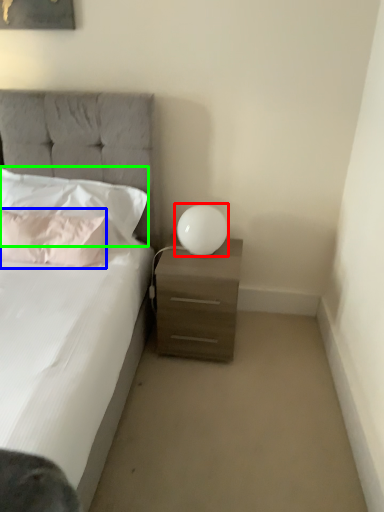
Question: Which object is the closest to the table lamp (highlighted by a red box)? Choose among these: pillow (highlighted by a blue box) or pillow (highlighted by a green box).

Choices:
 (A) pillow
 (B) pillow

Answer: (B)